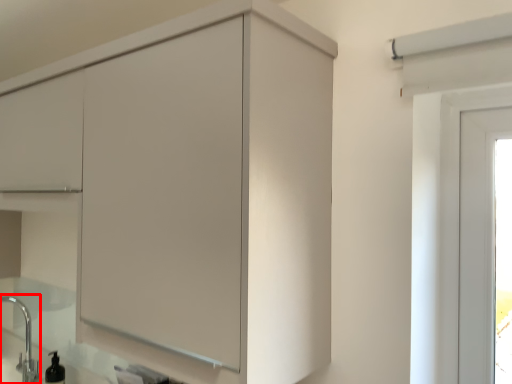
Question: Observing the image, what is the correct spatial positioning of faucet (annotated by the red box) in reference to cupboard?

Choices:
 (A) left
 (B) right

Answer: (A)